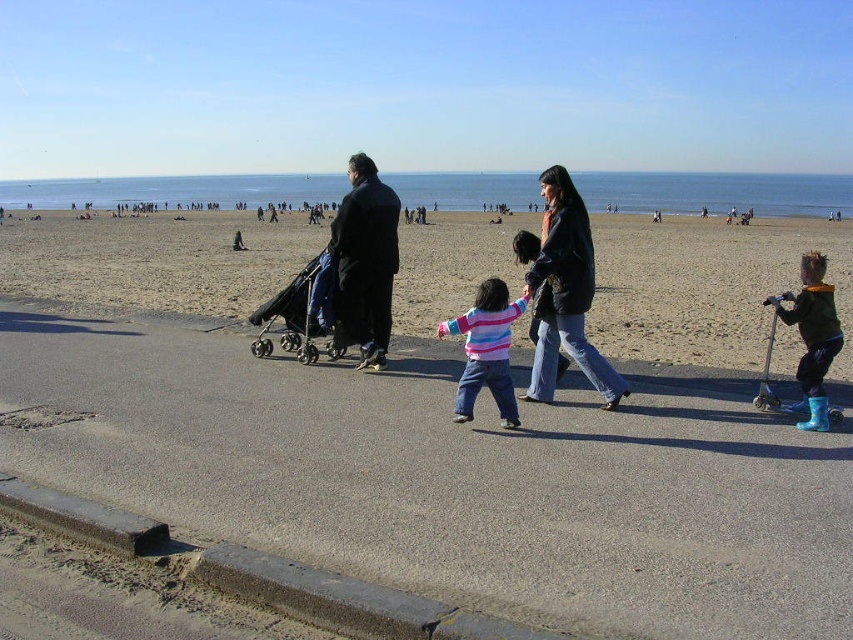
Question: Among these points, which one is nearest to the camera?

Choices:
 (A) (614, 227)
 (B) (503, 385)
 (C) (383, 227)

Answer: (B)

Question: Which object is the farthest from the black matte coat at center?

Choices:
 (A) sandy beach at lower center
 (B) rubber boots at right
 (C) dark blue plastic baby carriage at center

Answer: (A)

Question: Observing the image, what is the correct spatial positioning of sandy beach at lower center in reference to matte black jacket at center?

Choices:
 (A) above
 (B) below

Answer: (A)

Question: Is black matte coat at center above dark blue plastic baby carriage at center?

Choices:
 (A) no
 (B) yes

Answer: (B)

Question: Based on their relative distances, which object is farther from the dark blue plastic baby carriage at center?

Choices:
 (A) striped cotton sweater at center
 (B) sandy beach at lower center

Answer: (B)

Question: Can you confirm if matte black jacket at center is bigger than dark blue plastic baby carriage at center?

Choices:
 (A) no
 (B) yes

Answer: (B)